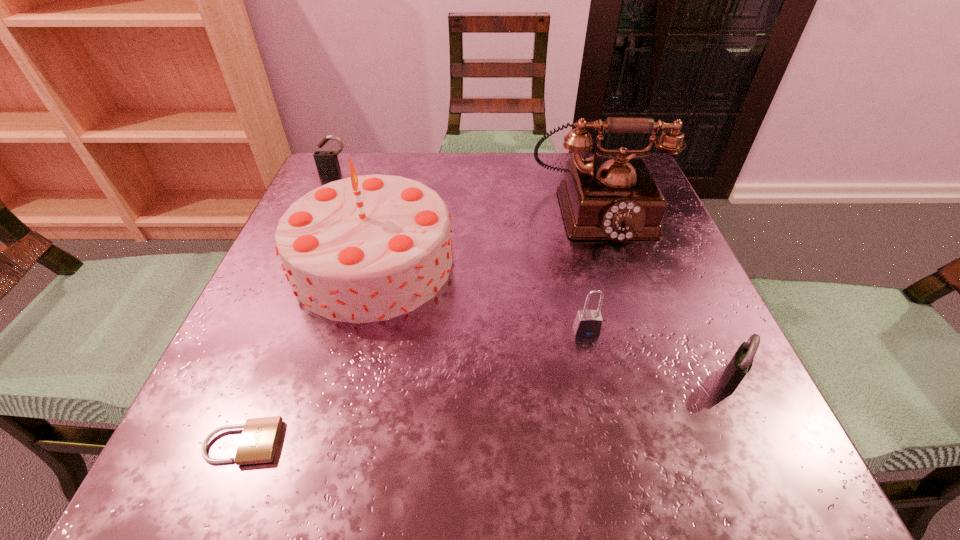
This screenshot has width=960, height=540. I want to click on vacant region between the nearest object and the birthday cake, so click(x=308, y=353).

Where is `vacant area between the birthday cake and the fifth farthest object`? Image resolution: width=960 pixels, height=540 pixels. vacant area between the birthday cake and the fifth farthest object is located at coordinates (552, 320).

Find the location of `empty location between the telephone and the birthday cake`. empty location between the telephone and the birthday cake is located at coordinates point(485,236).

The height and width of the screenshot is (540, 960). Find the location of `free space between the farthest object and the shortest padlock`. free space between the farthest object and the shortest padlock is located at coordinates (289, 307).

In order to click on vacant area that lies between the telephone and the farthest padlock in this screenshot , I will do `click(466, 191)`.

At what (x,y) coordinates should I click in order to perform the action: click on vacant space that's between the birthday cake and the fifth farthest object. Please return your answer as a coordinate pair (x, y). Image resolution: width=960 pixels, height=540 pixels. Looking at the image, I should click on (552, 320).

You are a GUI agent. You are given a task and a screenshot of the screen. Output one action in this format:
    pyautogui.click(x=<x>, y=<y>)
    Task: Click on the free space between the second farthest padlock and the nearest object
    The width and height of the screenshot is (960, 540).
    Given the screenshot: What is the action you would take?
    pyautogui.click(x=415, y=387)

The width and height of the screenshot is (960, 540). Identify the location of the second closest object to the telephone. (588, 323).

Identify which object is the nearest to the farthest padlock. Please provide its 2D coordinates. Your answer should be formatted as a tuple, i.e. [(x, y)], where the tuple contains the x and y coordinates of a point satisfying the conditions above.

[(368, 248)]

Identify which padlock is the third closest to the birthday cake. Please provide its 2D coordinates. Your answer should be formatted as a tuple, i.e. [(x, y)], where the tuple contains the x and y coordinates of a point satisfying the conditions above.

[(588, 323)]